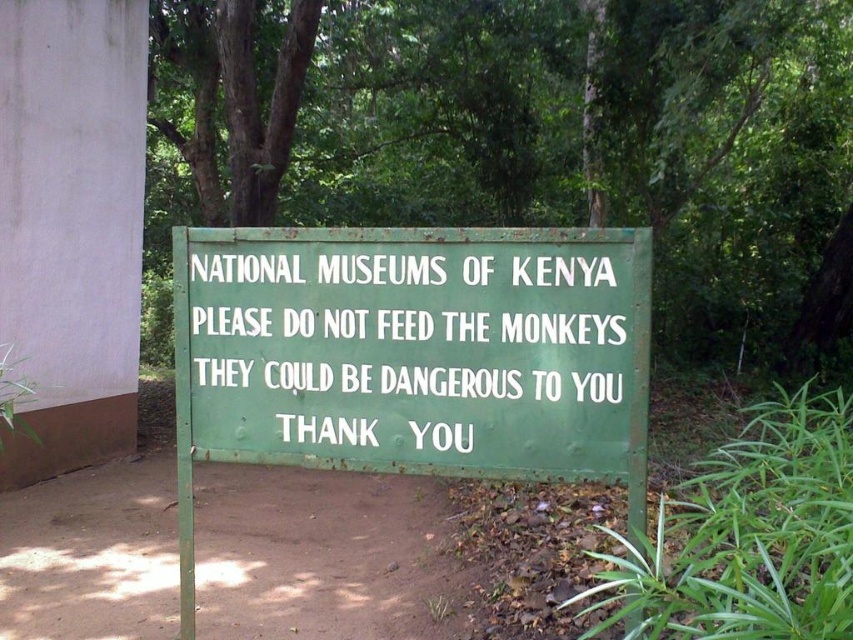
You are standing at point A, which is at the coordinates of point (427, 458). You want to move to point B at (703, 320). However, there is a large tree trunk blocking your path. Can you see point B from your current position at point A?

Point (703, 320) is behind point (427, 458), so you cannot see point B from your current position at point A because it is obstructed by the tree trunk located at point A.